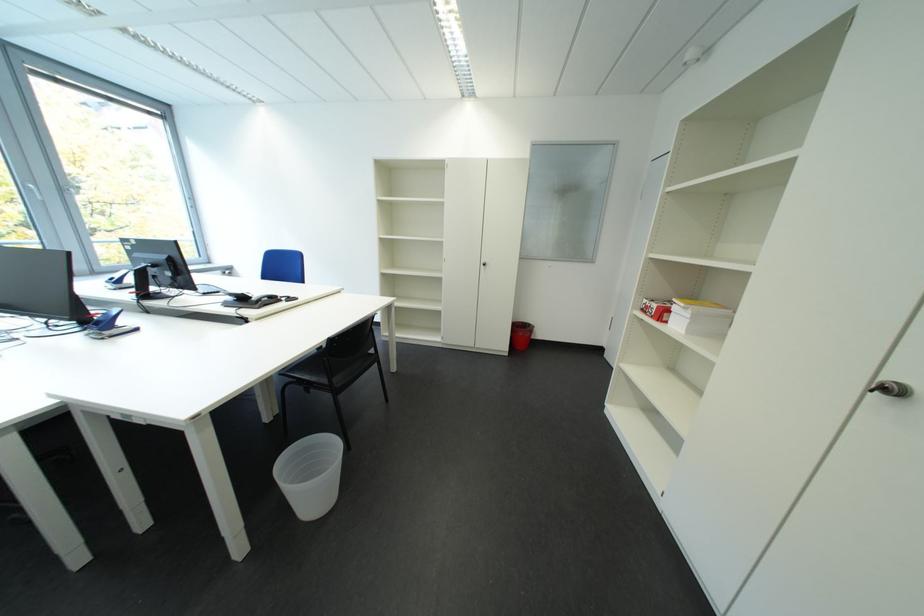
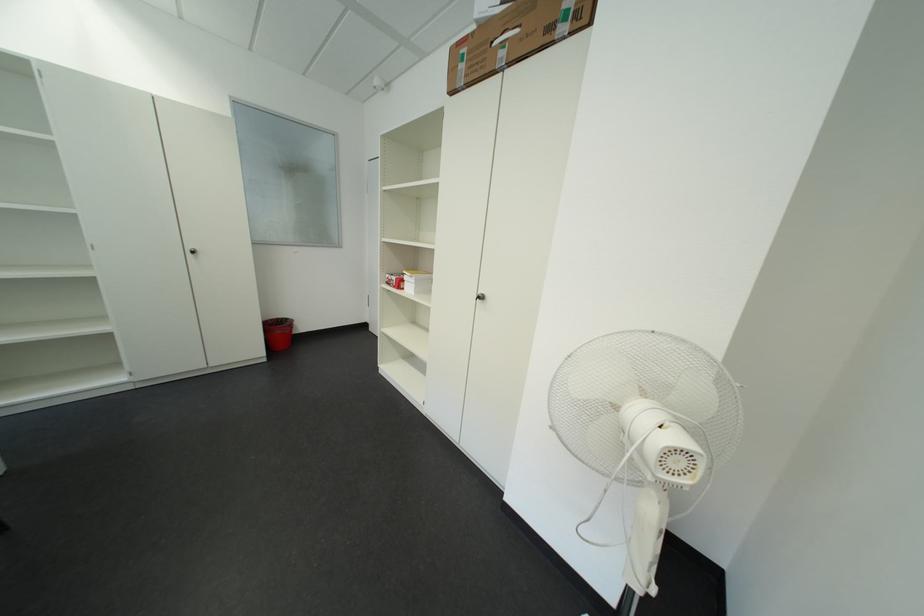
Locate, in the second image, the point that corresponds to (533,333) in the first image.

(289, 331)